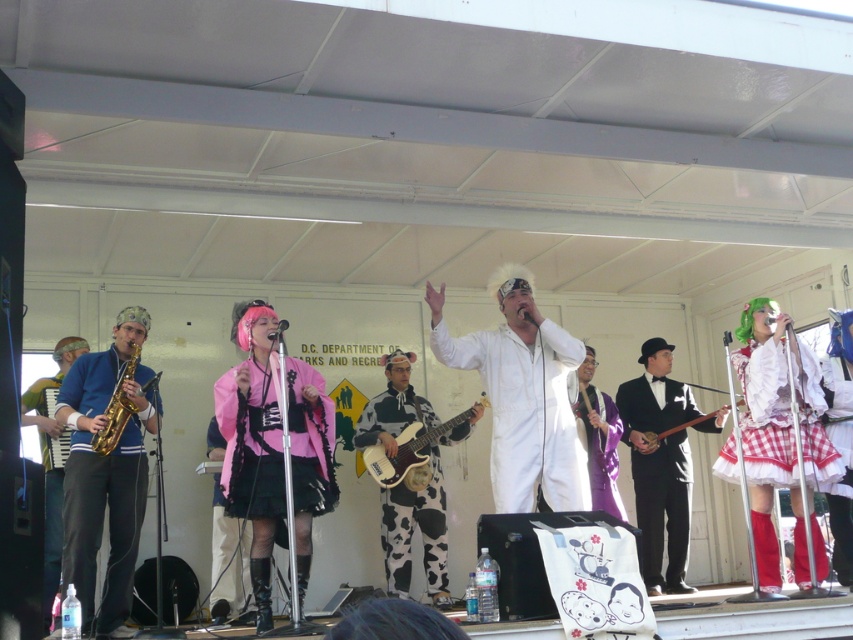
Which is in front, point (401, 422) or point (697, 420)?

Positioned in front is point (697, 420).

Can you confirm if cow print fabric guitar at center is positioned below wooden banjo at center?

Correct, cow print fabric guitar at center is located below wooden banjo at center.

Does point (433, 570) come closer to viewer compared to point (683, 426)?

Yes.

This screenshot has height=640, width=853. I want to click on cow print fabric guitar at center, so click(419, 522).

Which is more to the left, matte pink fabric at center or wooden banjo at center?

matte pink fabric at center

Between point (305, 442) and point (722, 410), which one is positioned in front?

Point (305, 442) is in front.

Locate an element on the screen. Image resolution: width=853 pixels, height=640 pixels. matte pink fabric at center is located at coordinates (250, 444).

Consider the image. Can you confirm if gold shiny saxophone at left is positioned above matte pink fabric at center?

Actually, gold shiny saxophone at left is below matte pink fabric at center.

Can you confirm if gold shiny saxophone at left is bigger than matte pink fabric at center?

Indeed, gold shiny saxophone at left has a larger size compared to matte pink fabric at center.

Is point (74, 497) positioned in front of point (229, 432)?

No, it is not.

I want to click on gold shiny saxophone at left, so click(103, 483).